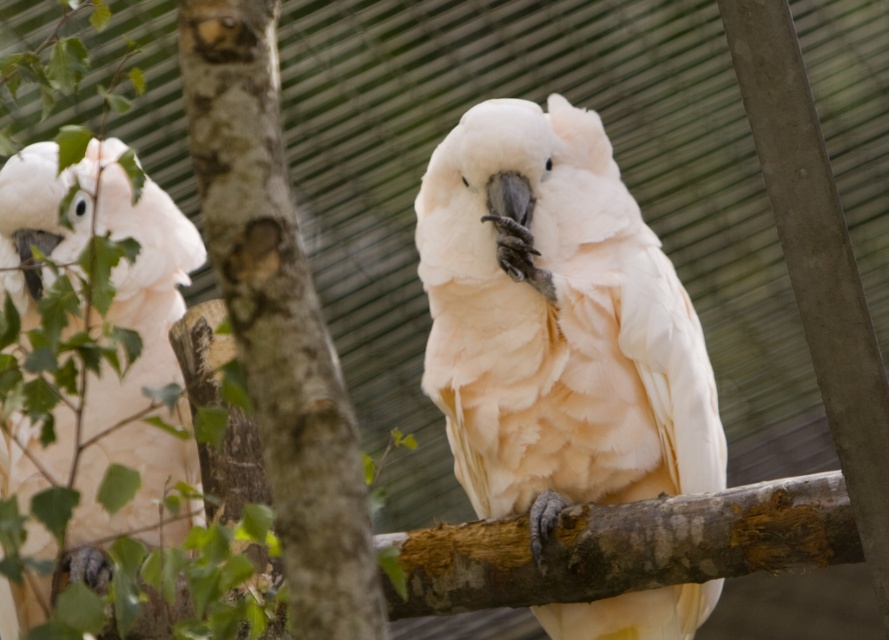
Which is above, white feathered parrot at center or white feathered parrot at left?

white feathered parrot at left is higher up.

Who is more forward, [537,388] or [101,557]?

Point [537,388] is in front.

Is point (430, 218) closer to camera compared to point (84, 208)?

Yes, point (430, 218) is closer to viewer.

Where is `white feathered parrot at center`? The width and height of the screenshot is (889, 640). white feathered parrot at center is located at coordinates (557, 323).